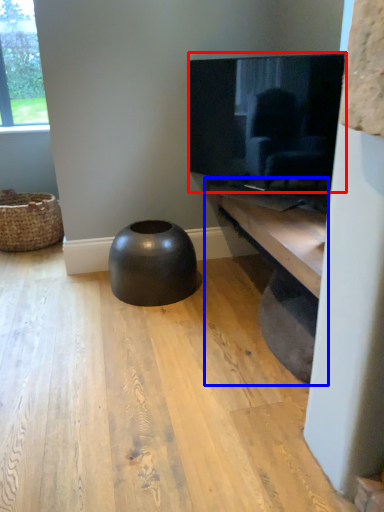
Question: Which of the following is the closest to the observer, television (highlighted by a red box) or shelf (highlighted by a blue box)?

Choices:
 (A) television
 (B) shelf

Answer: (B)